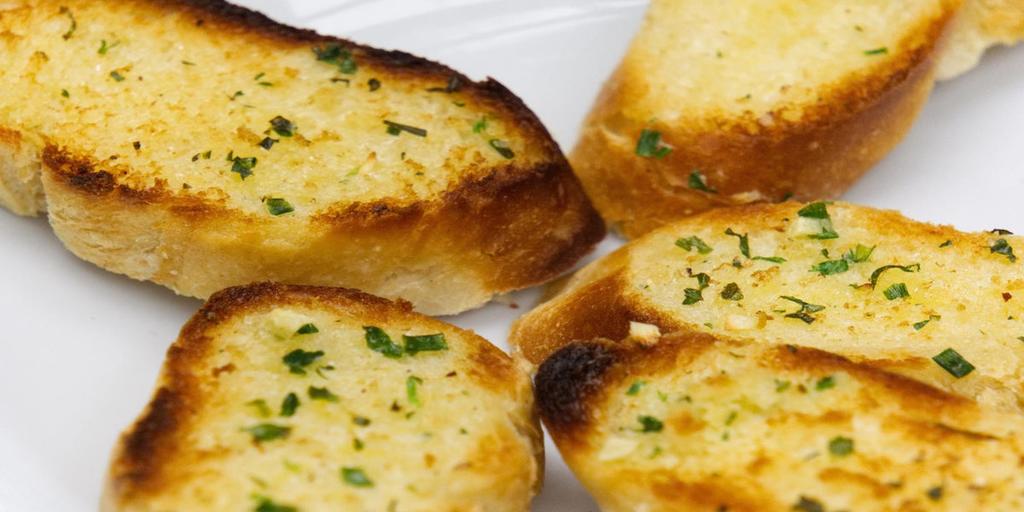
Find the location of a particular element. white plate is located at coordinates point(49,381), point(563,45), point(974,163).